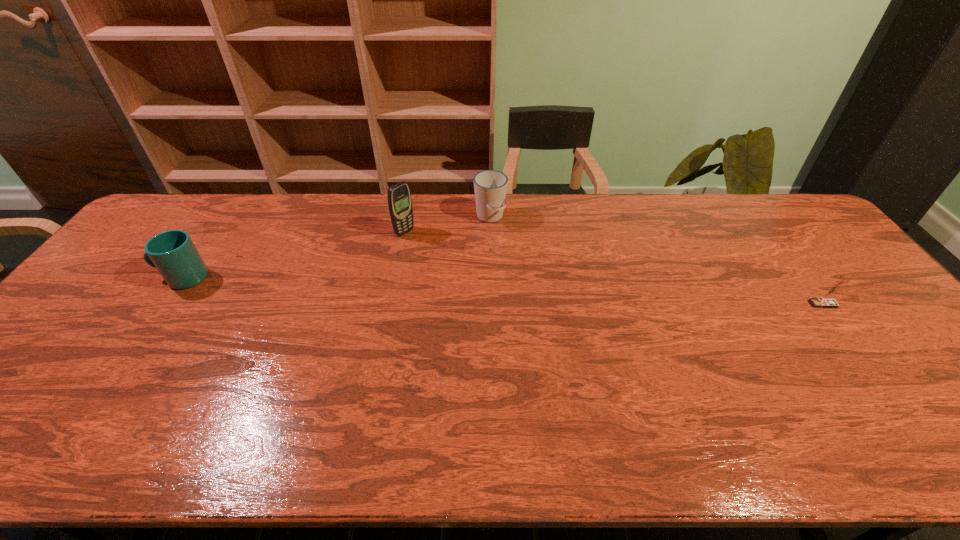
Identify the location of vacant space located 0.220m on the front of the nearest object. The image size is (960, 540). (878, 379).

At what (x,y) coordinates should I click in order to perform the action: click on free spot located 0.070m on the screen of the second object from left to right. Please return your answer as a coordinate pair (x, y). This screenshot has width=960, height=540. Looking at the image, I should click on (425, 247).

This screenshot has width=960, height=540. What are the coordinates of `vacant space located 0.350m on the screen of the second object from left to right` in the screenshot? It's located at (491, 291).

I want to click on free space located 0.350m on the screen of the second object from left to right, so click(x=491, y=291).

The width and height of the screenshot is (960, 540). What are the coordinates of `vacant space positioned with a handle on the side of the farther cup` in the screenshot? It's located at (543, 303).

Locate an element on the screen. This screenshot has width=960, height=540. vacant space located 0.280m with a handle on the side of the farther cup is located at coordinates (531, 284).

The image size is (960, 540). Identify the location of vacant area situated with a handle on the side of the farther cup. (530, 282).

Locate an element on the screen. cellular telephone located in the far edge section of the desktop is located at coordinates (399, 196).

Find the location of a particular element. The image size is (960, 540). cup at the far edge is located at coordinates [x=490, y=186].

Locate an element on the screen. This screenshot has width=960, height=540. object situated at the right edge is located at coordinates (829, 302).